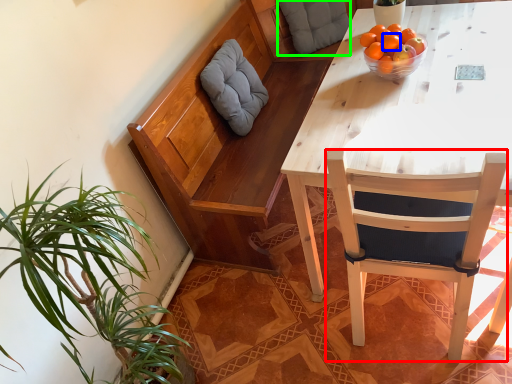
Question: Which object is the closest to the chair (highlighted by a red box)? Choose among these: tangerine (highlighted by a blue box) or pillow (highlighted by a green box).

Choices:
 (A) tangerine
 (B) pillow

Answer: (A)